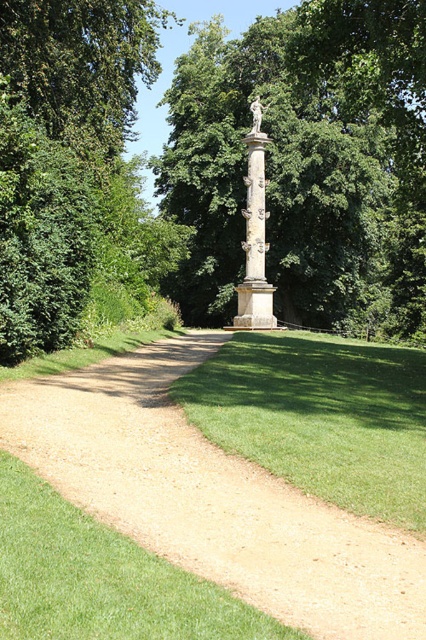
Which of these two, green grass at center or beige stone column at center, stands shorter?

With less height is green grass at center.

Looking at this image, is green grass at center above beige stone column at center?

Incorrect, green grass at center is not positioned above beige stone column at center.

At what (x,y) coordinates should I click in order to perform the action: click on green grass at center. Please return your answer as a coordinate pair (x, y). Looking at the image, I should click on (319, 417).

Is point (391, 125) less distant than point (411, 417)?

That is False.

Is green leafy tree at center to the right of green grass at center from the viewer's perspective?

Indeed, green leafy tree at center is positioned on the right side of green grass at center.

You are a GUI agent. You are given a task and a screenshot of the screen. Output one action in this format:
    pyautogui.click(x=<x>, y=<y>)
    Task: Click on the green leafy tree at center
    The image size is (426, 640).
    Given the screenshot: What is the action you would take?
    pyautogui.click(x=307, y=163)

The width and height of the screenshot is (426, 640). I want to click on green leafy tree at center, so click(307, 163).

Who is shorter, beige stone column at center or white marble statue at center?

white marble statue at center is shorter.

Does point (247, 324) come closer to viewer compared to point (256, 120)?

Yes, point (247, 324) is closer to viewer.

The height and width of the screenshot is (640, 426). I want to click on beige stone column at center, so click(255, 236).